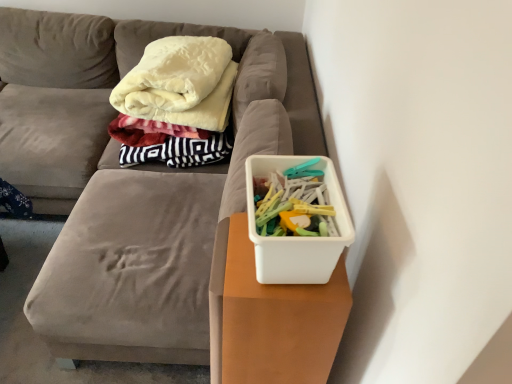
Question: In terms of width, does white plastic container at center look wider or thinner when compared to white plastic container at right?

Choices:
 (A) thin
 (B) wide

Answer: (B)

Question: From a real-world perspective, is white plastic container at center positioned above or below white plastic container at right?

Choices:
 (A) below
 (B) above

Answer: (A)

Question: Which object is the closest to the white plastic container at right?

Choices:
 (A) white plastic container at right
 (B) white plastic container at center

Answer: (A)

Question: Considering the real-world distances, which object is farthest from the white plastic container at right?

Choices:
 (A) white plastic container at right
 (B) white plastic container at center

Answer: (B)